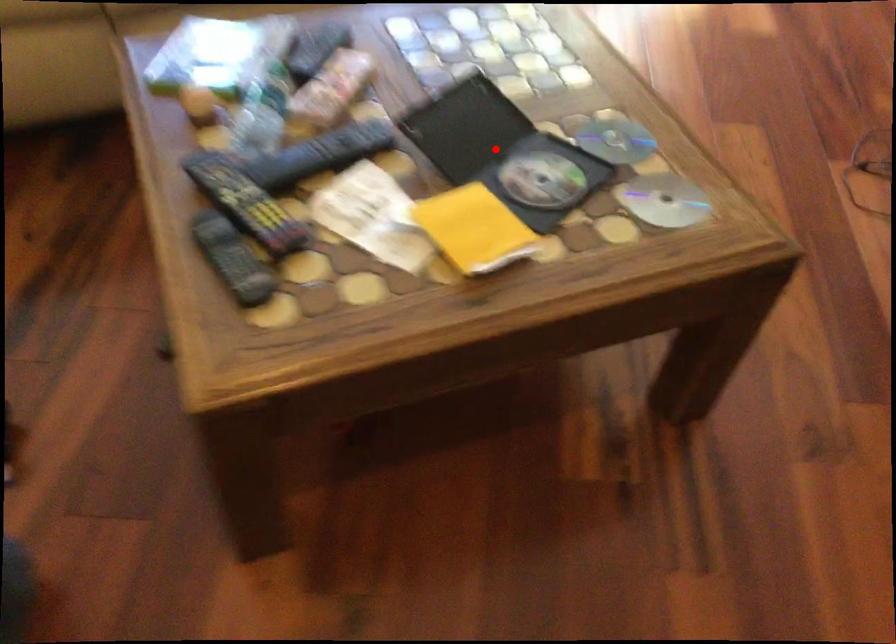
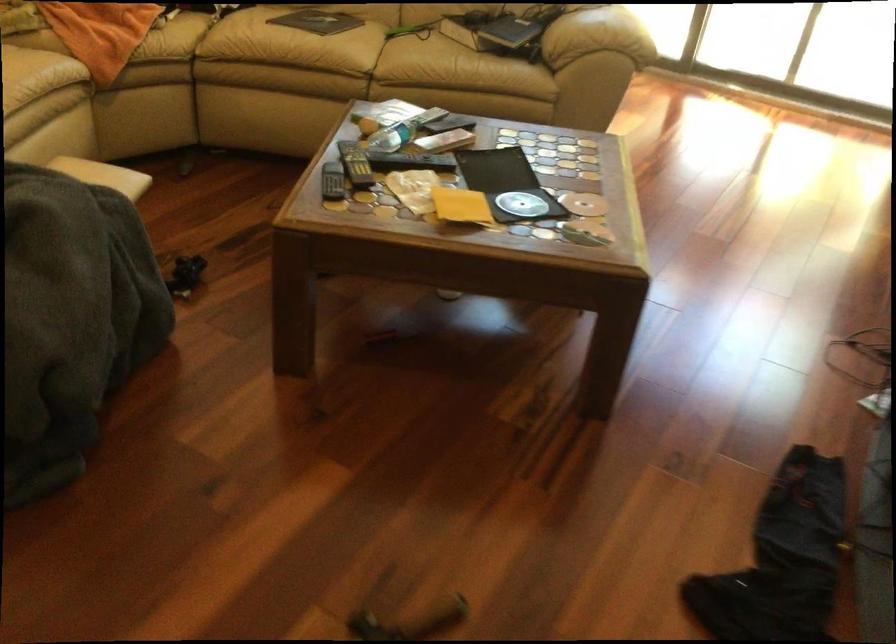
Question: I am providing you with two images of the same scene from different viewpoints. Given a red point in image1, look at the same physical point in image2. Is it:

Choices:
 (A) Closer to the viewpoint
 (B) Farther from the viewpoint

Answer: (B)